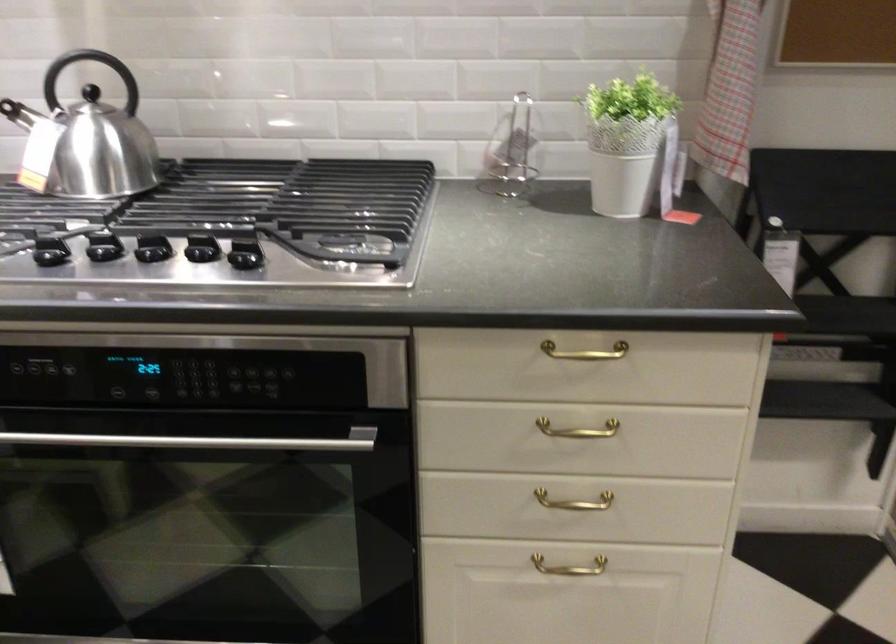
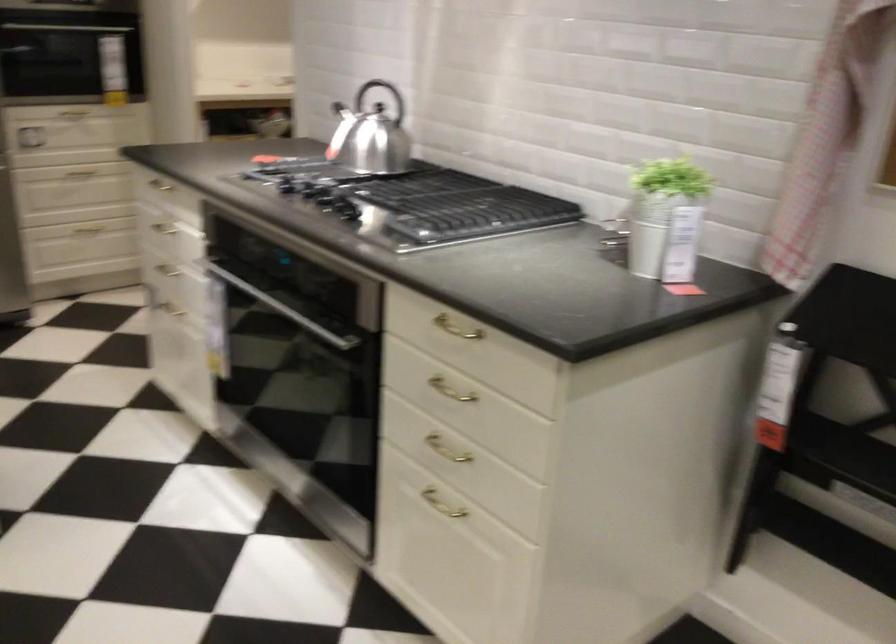
The point at (x=567, y=354) is marked in the first image. Where is the corresponding point in the second image?

(455, 328)